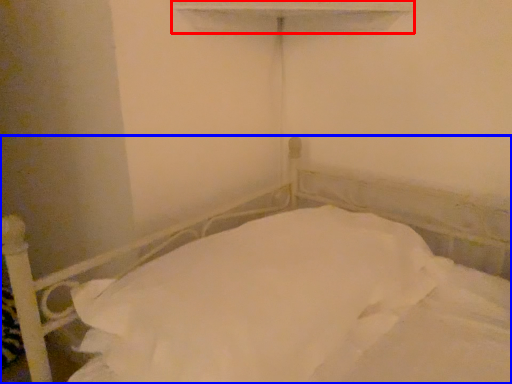
Question: Among these objects, which one is farthest to the camera, window sill (highlighted by a red box) or bed (highlighted by a blue box)?

Choices:
 (A) window sill
 (B) bed

Answer: (A)